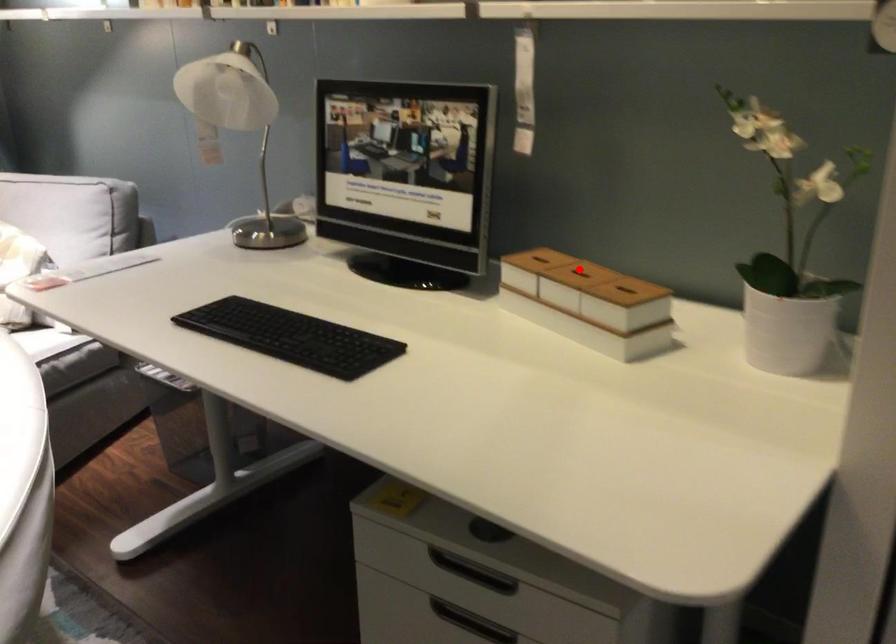
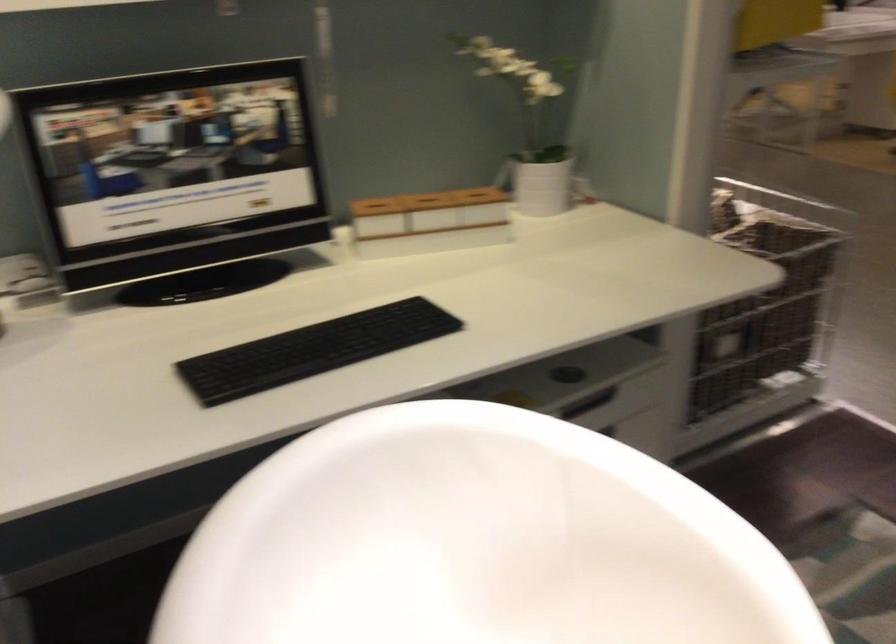
Question: I am providing you with two images of the same scene from different viewpoints. Image1 has a red point marked. In image2, the corresponding 3D location appears at what relative position? Reply with the corresponding letter.

Choices:
 (A) Closer
 (B) Farther

Answer: (B)